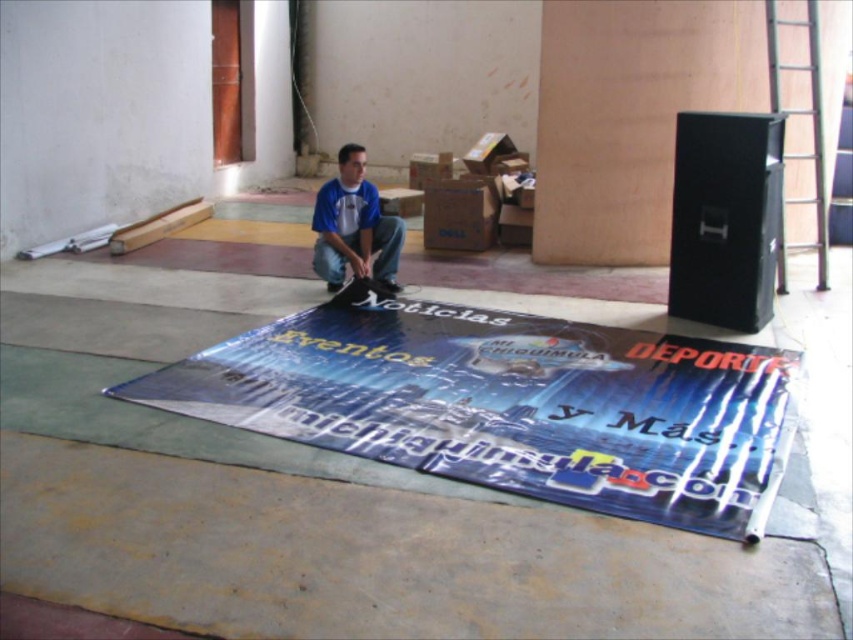
Question: Is the position of shiny plastic poster at center more distant than that of black matte speaker at upper right?

Choices:
 (A) yes
 (B) no

Answer: (B)

Question: Can you confirm if shiny plastic poster at center is positioned to the left of blue cotton shirt at center?

Choices:
 (A) yes
 (B) no

Answer: (B)

Question: Which of the following is the closest to the observer?

Choices:
 (A) black matte speaker at upper right
 (B) blue cotton shirt at center
 (C) shiny plastic poster at center

Answer: (C)

Question: Which point is farther to the camera?

Choices:
 (A) blue cotton shirt at center
 (B) shiny plastic poster at center
 (C) black matte speaker at upper right

Answer: (A)

Question: Can you confirm if shiny plastic poster at center is bigger than blue cotton shirt at center?

Choices:
 (A) no
 (B) yes

Answer: (B)

Question: Which object is the farthest from the shiny plastic poster at center?

Choices:
 (A) blue cotton shirt at center
 (B) black matte speaker at upper right

Answer: (A)